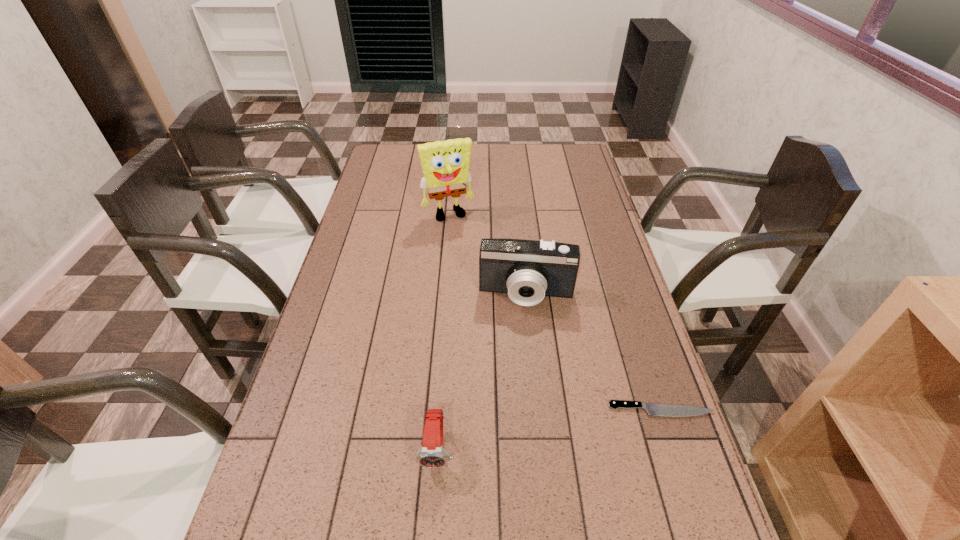
In order to click on vacant region at the far left corner of the desktop in this screenshot , I will do `click(385, 168)`.

Locate an element on the screen. The height and width of the screenshot is (540, 960). blank region between the third tallest object and the steak knife is located at coordinates (549, 429).

Find the location of a particular element. free space between the rightmost object and the tallest object is located at coordinates (555, 313).

At what (x,y) coordinates should I click in order to perform the action: click on free area in between the third farthest object and the camcorder. Please return your answer as a coordinate pair (x, y). This screenshot has height=540, width=960. Looking at the image, I should click on (594, 353).

The height and width of the screenshot is (540, 960). I want to click on free space between the watch and the second farthest object, so click(482, 372).

Identify the location of unoccupied area between the rightmost object and the watch. This screenshot has height=540, width=960. (549, 429).

Find the location of a particular element. Image resolution: width=960 pixels, height=540 pixels. free area in between the second farthest object and the watch is located at coordinates (482, 372).

You are a GUI agent. You are given a task and a screenshot of the screen. Output one action in this format:
    pyautogui.click(x=<x>, y=<y>)
    Task: Click on the free space that is in between the farthest object and the rightmost object
    
    Given the screenshot: What is the action you would take?
    pyautogui.click(x=555, y=313)

I want to click on empty location between the watch and the camcorder, so click(482, 372).

The height and width of the screenshot is (540, 960). Identify the location of the third closest object to the camcorder. (431, 454).